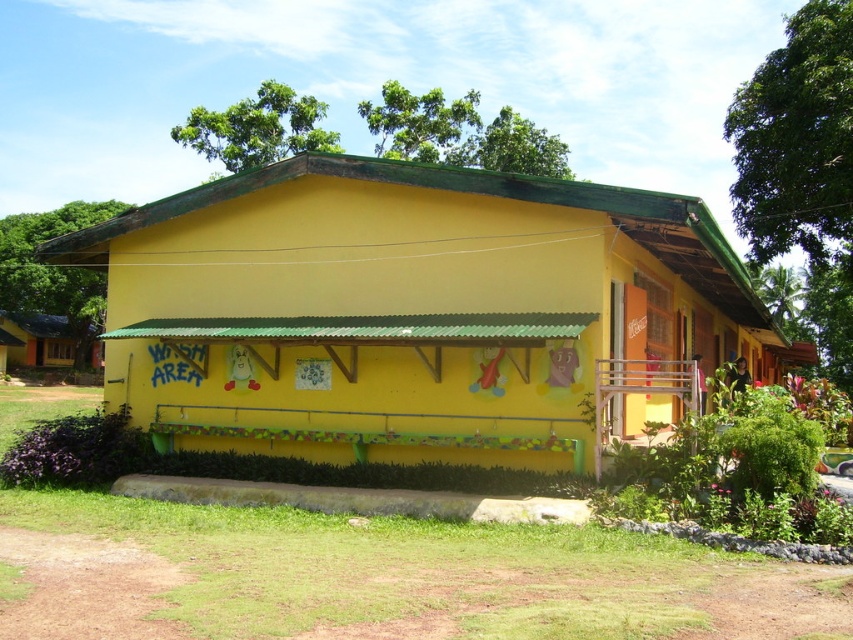
You are planning to set up a temporary food stall and need to choose between the yellow matte building at center and the matte yellow hut at lower left. Which location has more space for your stall?

The yellow matte building at center might be wider than matte yellow hut at lower left, so it likely has more space for your stall.

You are a visitor standing in front of the yellow matte building at center and the matte yellow hut at lower left. Which one is taller?

The yellow matte building at center is taller than the matte yellow hut at lower left.

You are standing in front of the building and want to determine which of the two points, point [589,470] or point [64,324], is closer to you. Based on the scene description, which point is nearer?

Point [589,470] is closer to the viewer than point [64,324].